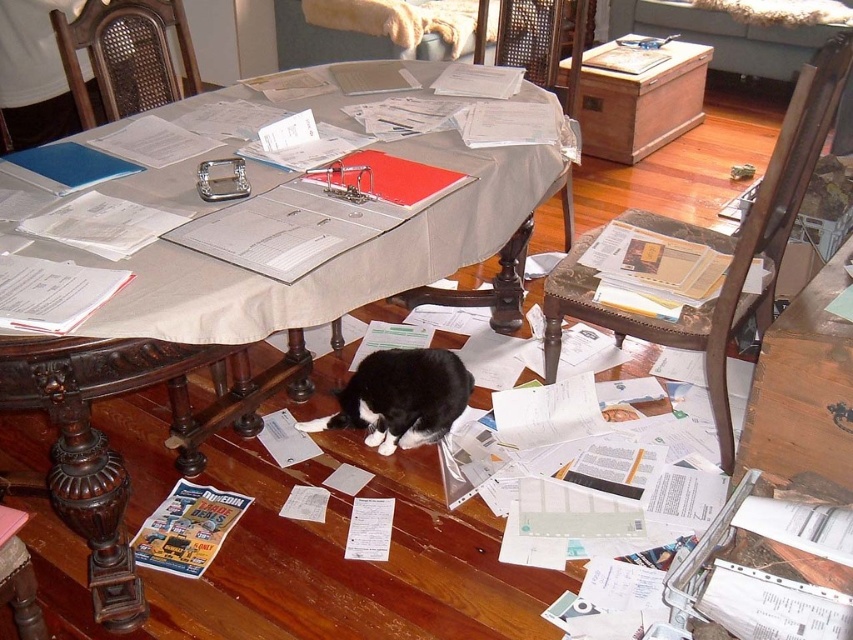
Based on the photo, who is more distant from viewer, (94, 314) or (380, 422)?

Point (380, 422)

Can you confirm if smooth beige table at center is positioned to the left of black fur cat at center?

Indeed, smooth beige table at center is positioned on the left side of black fur cat at center.

Between point (402, 250) and point (409, 442), which one is positioned behind?

The point (409, 442) is behind.

Where is `smooth beige table at center`? smooth beige table at center is located at coordinates (241, 332).